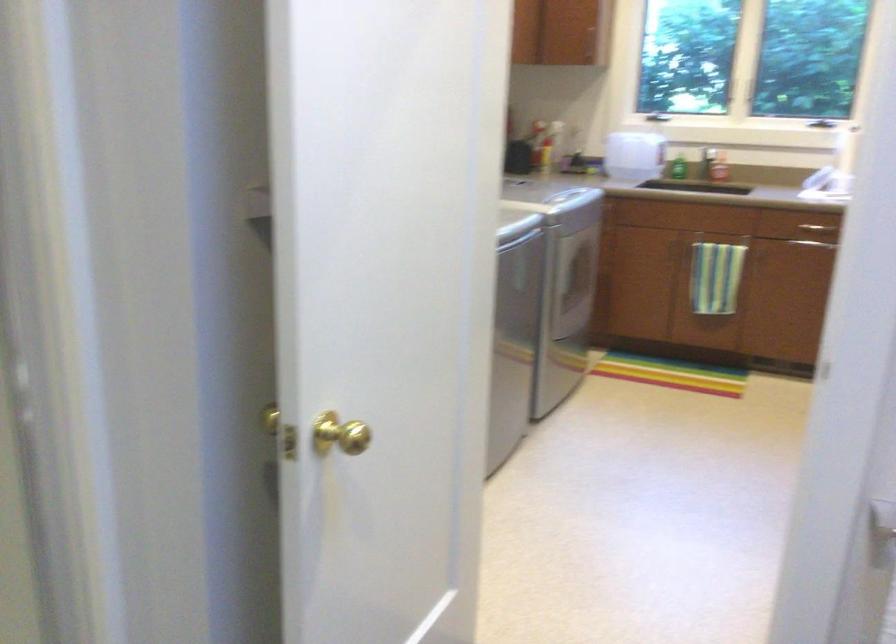
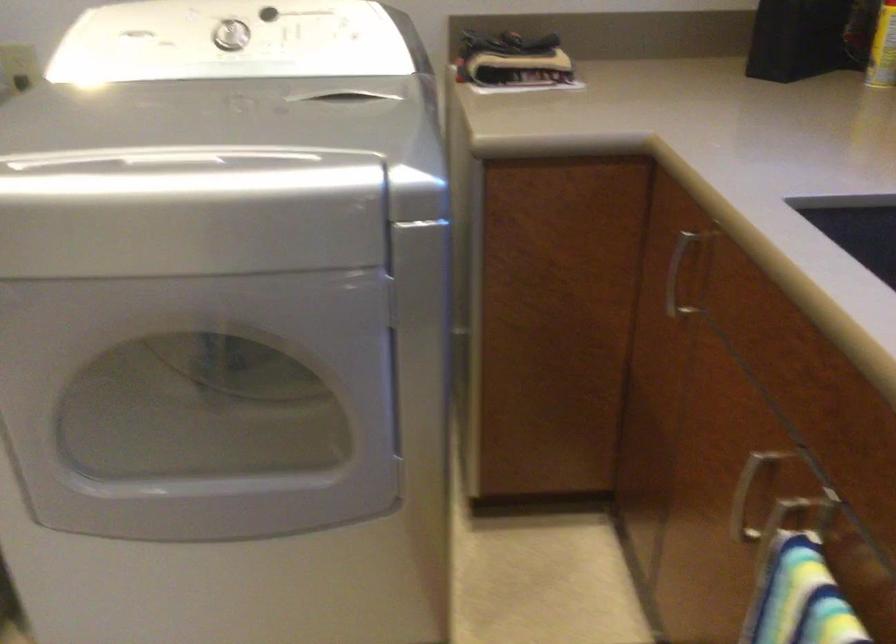
In the second image, find the point that corresponds to (538,154) in the first image.

(883, 49)